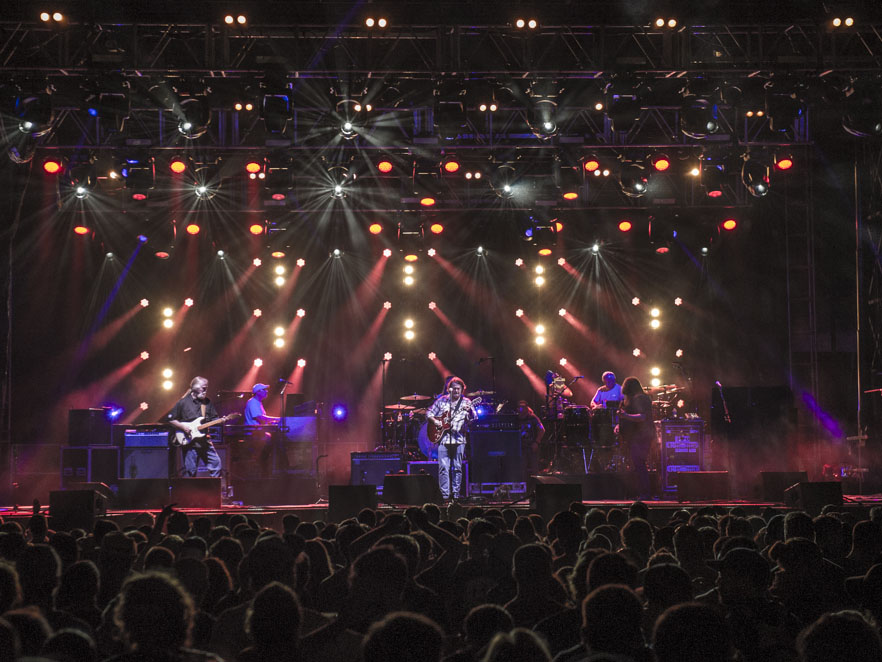
Locate an element on the screen. The image size is (882, 662). background lighting systems is located at coordinates (161, 287), (278, 294), (407, 298), (537, 306), (653, 295).